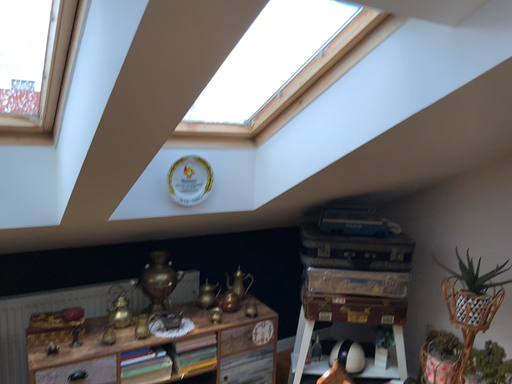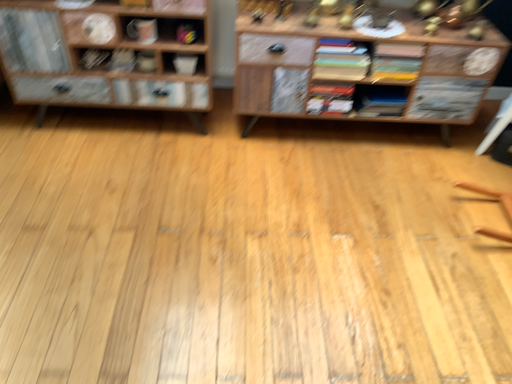
Question: How did the camera likely rotate when shooting the video?

Choices:
 (A) rotated left
 (B) rotated right

Answer: (A)